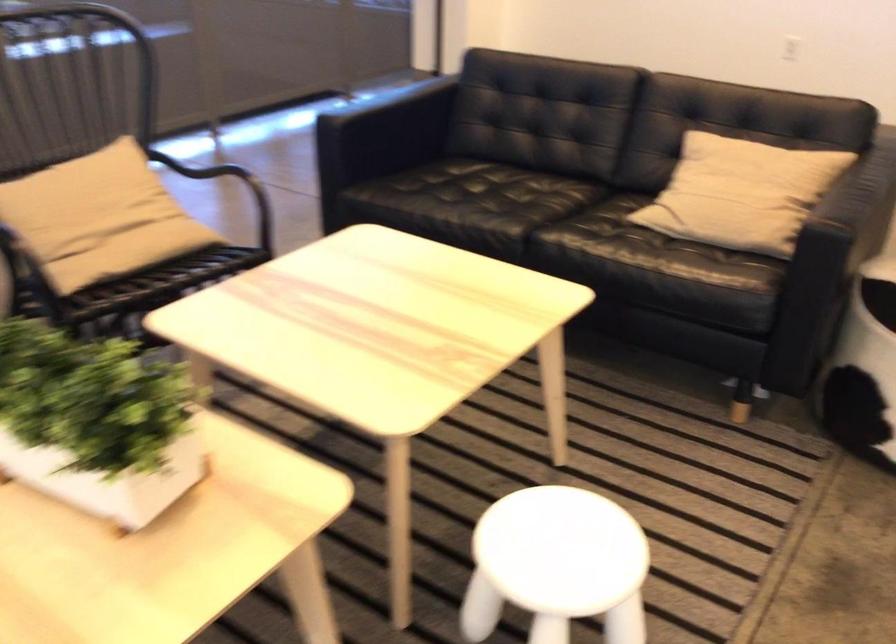
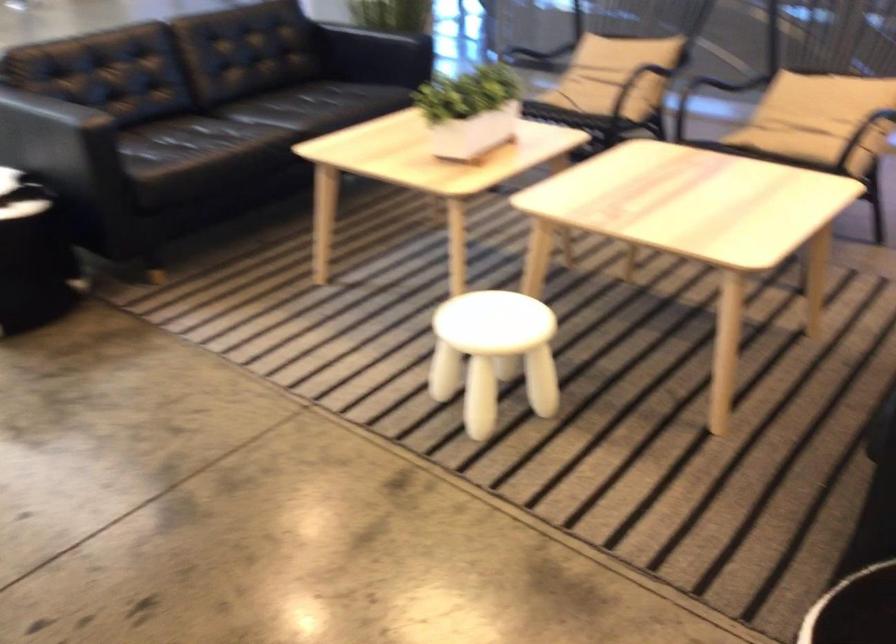
In the second image, find the point that corresponds to pixel 122 402 in the first image.

(470, 111)